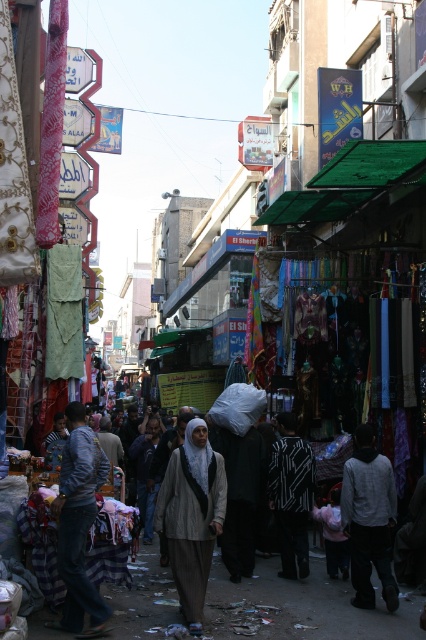
What do you see at coordinates (192, 516) in the screenshot?
I see `light brown fabric hijab at center` at bounding box center [192, 516].

Is point (196, 557) positioned before point (374, 476)?

Yes, it is.

Locate an element on the screen. Image resolution: width=426 pixels, height=640 pixels. light brown fabric hijab at center is located at coordinates (192, 516).